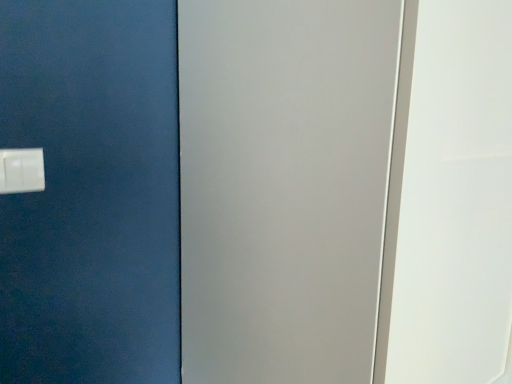
Question: Looking at their shapes, would you say white plastic light switch at lower left is wider or thinner than satin white screen door at center?

Choices:
 (A) thin
 (B) wide

Answer: (A)

Question: From the image's perspective, relative to satin white screen door at center, is white plastic light switch at lower left above or below?

Choices:
 (A) below
 (B) above

Answer: (B)

Question: From a real-world perspective, is white plastic light switch at lower left above or below satin white screen door at center?

Choices:
 (A) below
 (B) above

Answer: (B)

Question: Is satin white screen door at center wider or thinner than white plastic light switch at lower left?

Choices:
 (A) wide
 (B) thin

Answer: (A)

Question: Based on their sizes in the image, would you say satin white screen door at center is bigger or smaller than white plastic light switch at lower left?

Choices:
 (A) small
 (B) big

Answer: (B)

Question: Choose the correct answer: Is satin white screen door at center inside white plastic light switch at lower left or outside it?

Choices:
 (A) outside
 (B) inside

Answer: (A)

Question: Is satin white screen door at center to the left or to the right of white plastic light switch at lower left in the image?

Choices:
 (A) right
 (B) left

Answer: (A)